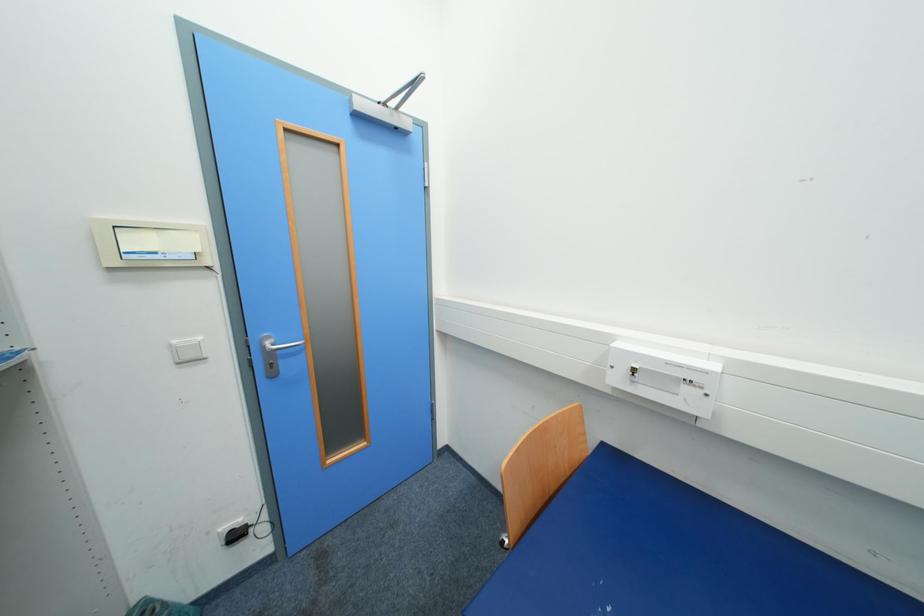
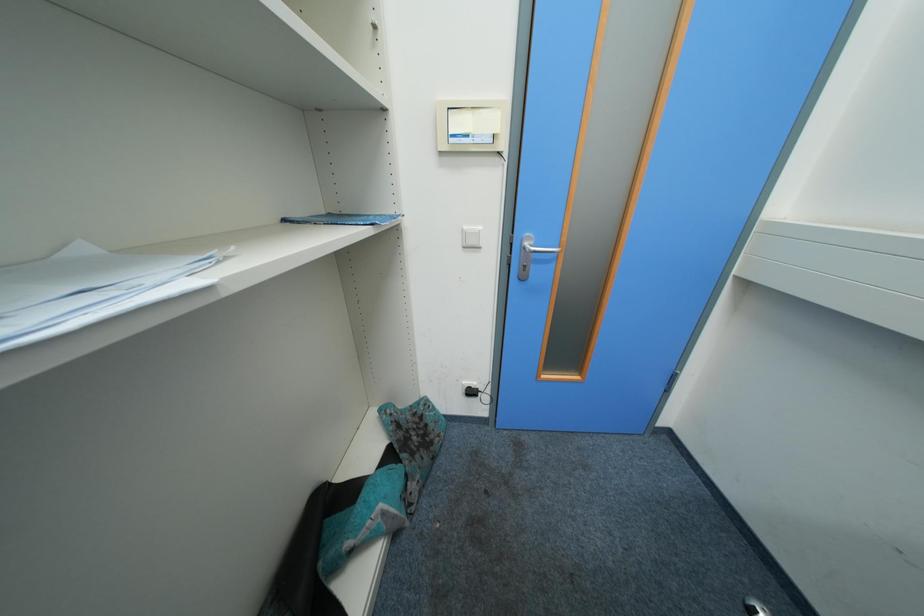
The images are taken continuously from a first-person perspective. In which direction is your viewpoint rotating?

The rotation direction of the camera is left-down.